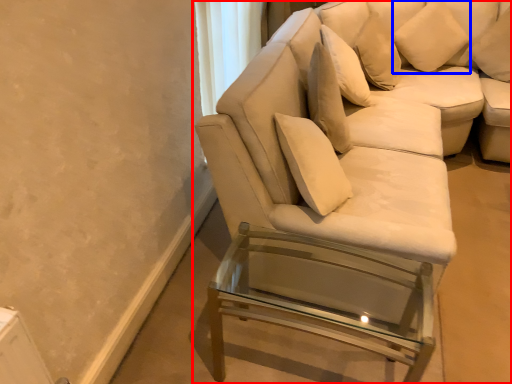
Question: Which point is closer to the camera, studio couch (highlighted by a red box) or pillow (highlighted by a blue box)?

Choices:
 (A) studio couch
 (B) pillow

Answer: (A)